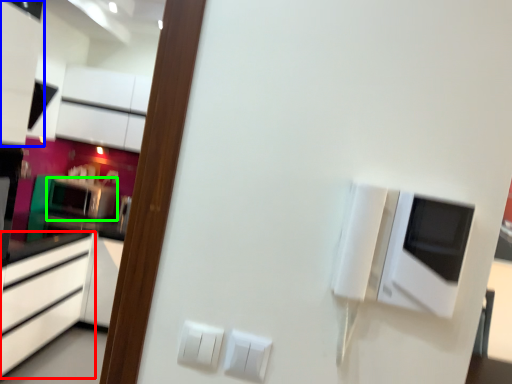
Question: Which is nearer to the cabinetry (highlighted by a red box)? cabinetry (highlighted by a blue box) or appliance (highlighted by a green box).

Choices:
 (A) cabinetry
 (B) appliance

Answer: (B)